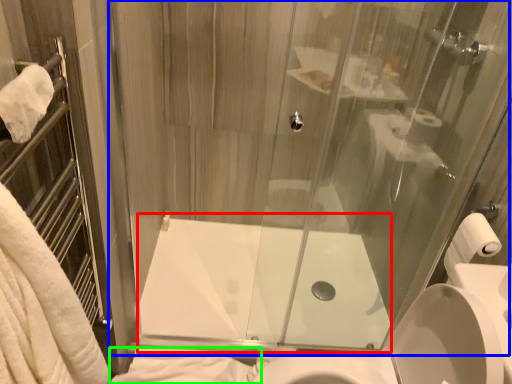
Question: Estimate the real-world distances between objects in this image. Which object is farther from bath (highlighted by a red box), glass door (highlighted by a blue box) or bath towel (highlighted by a green box)?

Choices:
 (A) glass door
 (B) bath towel

Answer: (A)